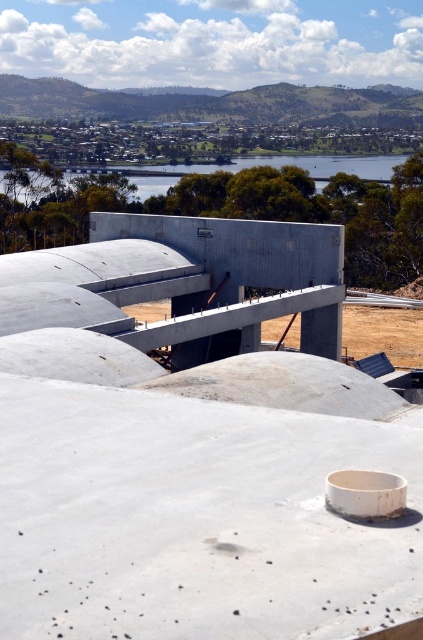
Can you confirm if white smooth concrete at center is wider than blue water at center?

In fact, white smooth concrete at center might be narrower than blue water at center.

Describe the element at coordinates (194, 518) in the screenshot. The height and width of the screenshot is (640, 423). I see `white smooth concrete at center` at that location.

Is point (271, 616) less distant than point (379, 156)?

Yes, it is.

Locate an element on the screen. white smooth concrete at center is located at coordinates (194, 518).